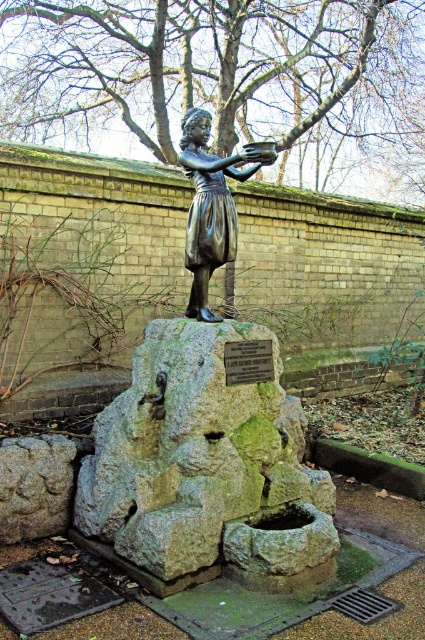
Is point (323, 554) positioned in front of point (198, 234)?

Yes, it is in front of point (198, 234).

Who is taller, shiny bronze statue at center or bronze statue at center?

With more height is shiny bronze statue at center.

Between point (183, 496) and point (215, 182), which one is positioned behind?

Positioned behind is point (215, 182).

Locate an element on the screen. Image resolution: width=425 pixels, height=640 pixels. shiny bronze statue at center is located at coordinates (206, 422).